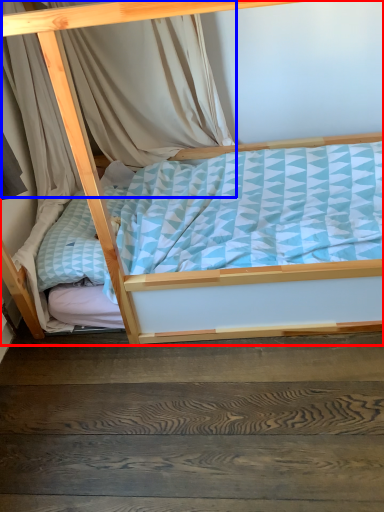
Question: Which object is closer to the camera taking this photo, bed (highlighted by a red box) or curtain (highlighted by a blue box)?

Choices:
 (A) bed
 (B) curtain

Answer: (A)